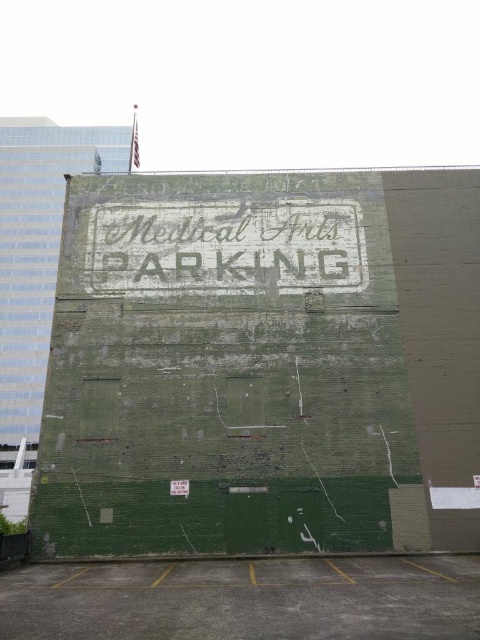
Question: Can you confirm if gray concrete parking lot at lower center is thinner than white distressed sign at center?

Choices:
 (A) no
 (B) yes

Answer: (A)

Question: Which object appears farthest from the camera in this image?

Choices:
 (A) white distressed sign at center
 (B) gray concrete parking lot at lower center

Answer: (A)

Question: Does gray concrete parking lot at lower center have a smaller size compared to white distressed sign at center?

Choices:
 (A) no
 (B) yes

Answer: (A)

Question: Among these objects, which one is nearest to the camera?

Choices:
 (A) white distressed sign at center
 (B) gray concrete parking lot at lower center

Answer: (B)

Question: Which of the following is the closest to the observer?

Choices:
 (A) (357, 596)
 (B) (351, 266)

Answer: (A)

Question: Is gray concrete parking lot at lower center bigger than white distressed sign at center?

Choices:
 (A) yes
 (B) no

Answer: (A)